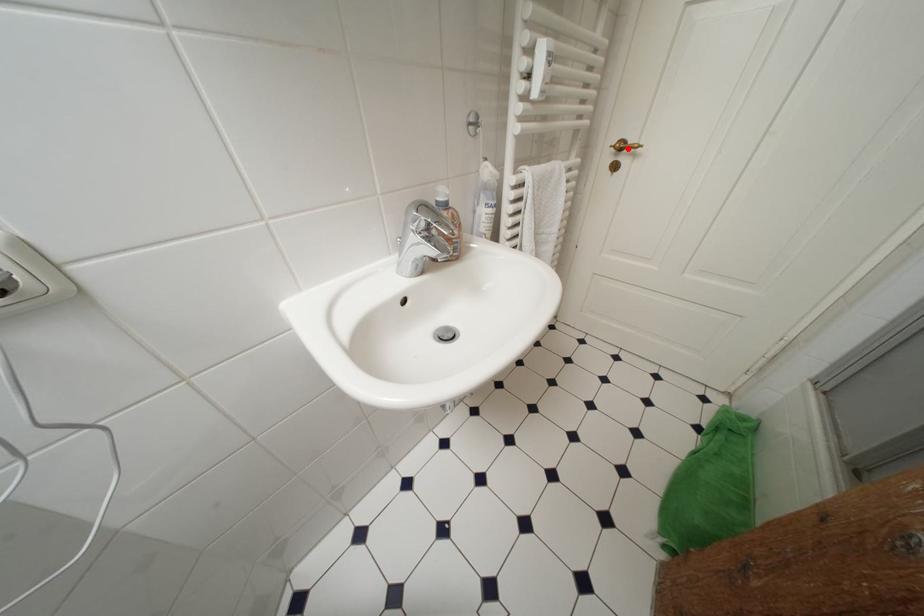
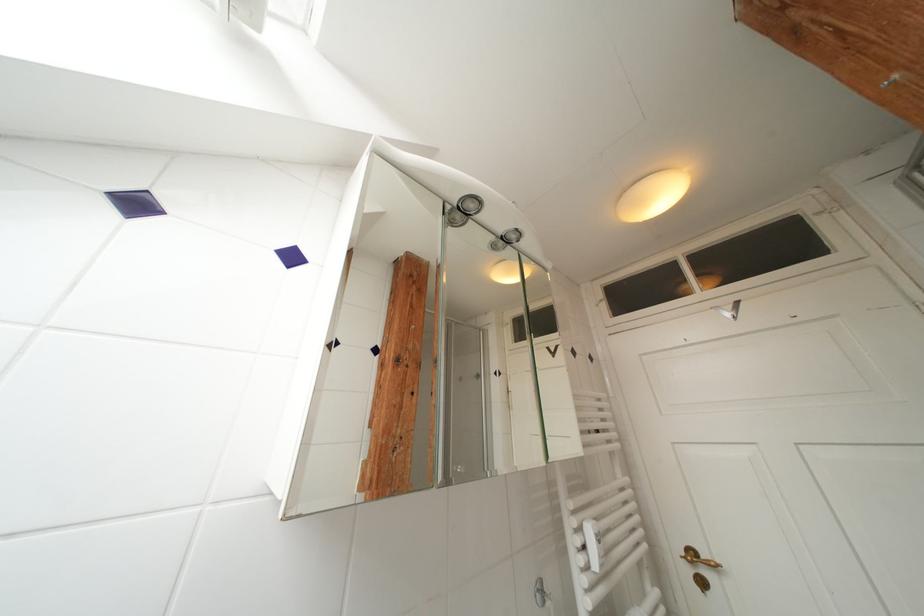
In the second image, find the point that corresponds to the highlighted location in the first image.

(699, 557)